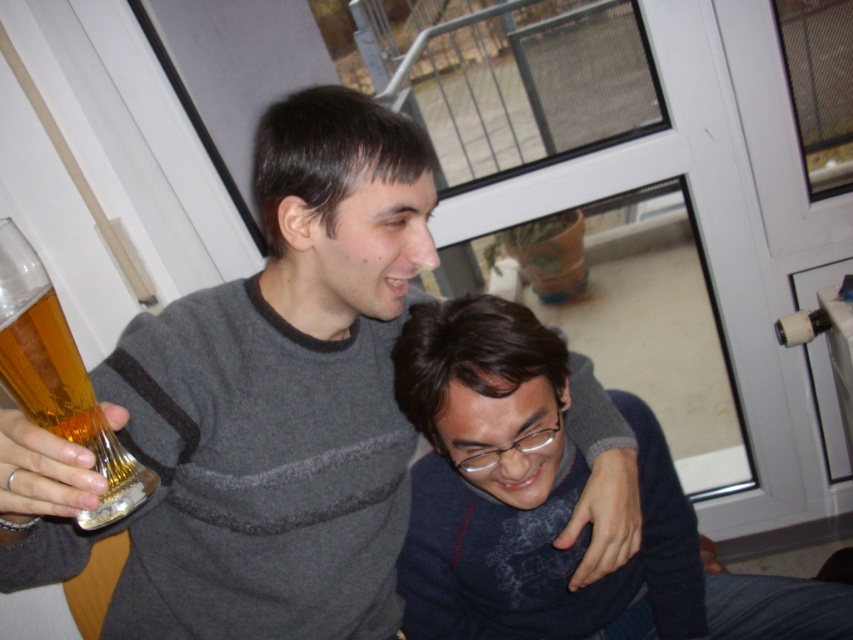
Which is above, gray striped sweater at upper center or translucent glass beer at left?

translucent glass beer at left

Between point (169, 536) and point (78, 380), which one is positioned in front?

Point (78, 380)

What are the coordinates of `gray striped sweater at upper center` in the screenshot? It's located at (282, 396).

Which is more to the right, gray striped sweater at upper center or dark blue sweater at lower right?

Positioned to the right is dark blue sweater at lower right.

Is gray striped sweater at upper center above dark blue sweater at lower right?

Yes.

Does point (306, 394) come closer to viewer compared to point (430, 396)?

That is False.

In order to click on gray striped sweater at upper center in this screenshot , I will do `click(282, 396)`.

Can you confirm if dark blue sweater at lower right is positioned to the left of translucent glass beer at left?

No, dark blue sweater at lower right is not to the left of translucent glass beer at left.

Does dark blue sweater at lower right have a lesser width compared to translucent glass beer at left?

In fact, dark blue sweater at lower right might be wider than translucent glass beer at left.

Who is more distant from viewer, (425,518) or (56,330)?

Point (425,518)

Where is `dark blue sweater at lower right`? dark blue sweater at lower right is located at coordinates (550, 502).